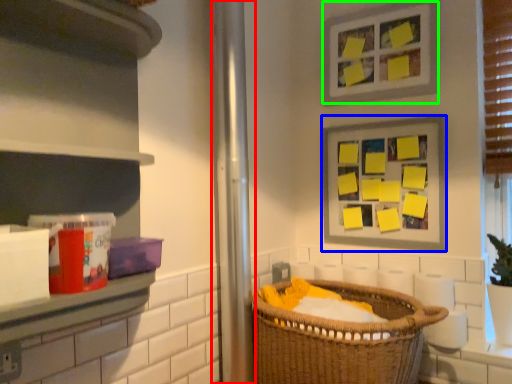
Question: Estimate the real-world distances between objects in this image. Which object is closer to screen door (highlighted by a red box), picture frame (highlighted by a blue box) or picture frame (highlighted by a green box)?

Choices:
 (A) picture frame
 (B) picture frame

Answer: (A)